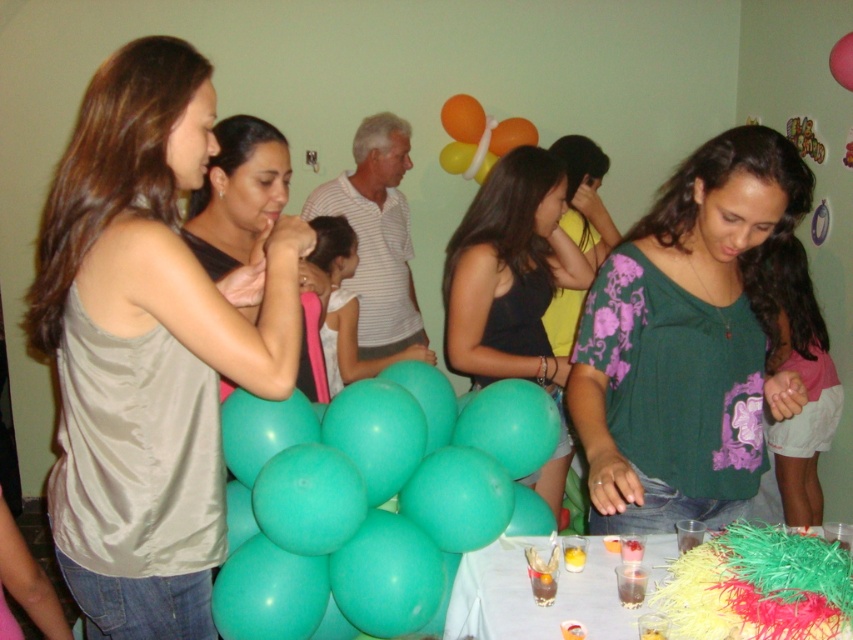
Question: Is satin beige tank top at left closer to the viewer compared to matte black shirt at center?

Choices:
 (A) yes
 (B) no

Answer: (A)

Question: Is green floral blouse at center thinner than shiny plastic cups at center?

Choices:
 (A) no
 (B) yes

Answer: (B)

Question: Does teal matte balloons at center have a lesser width compared to matte black shirt at center?

Choices:
 (A) yes
 (B) no

Answer: (B)

Question: Which of the following is the closest to the observer?

Choices:
 (A) white matte dress at center
 (B) rubber balloon at upper right
 (C) matte black shirt at center

Answer: (C)

Question: Based on their relative distances, which object is nearer to the teal matte balloons at center?

Choices:
 (A) white matte dress at center
 (B) shiny plastic cups at center
 (C) green floral blouse at center
 (D) black satin dress at center

Answer: (B)

Question: Which object is closer to the camera taking this photo?

Choices:
 (A) black satin dress at center
 (B) satin beige tank top at left
 (C) rubber balloon at upper right

Answer: (B)